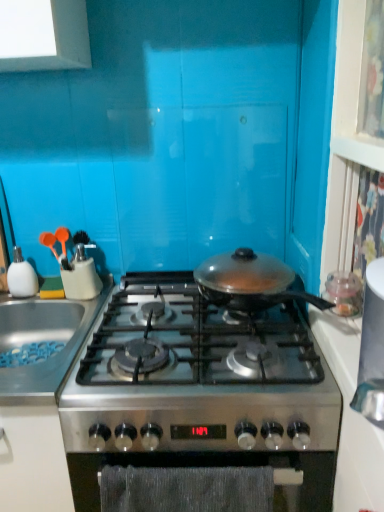
Question: Is textured gray oven at center behind white glossy soap dispenser at left?

Choices:
 (A) yes
 (B) no

Answer: (B)

Question: From the image's perspective, would you say textured gray oven at center is shown under white glossy soap dispenser at left?

Choices:
 (A) no
 (B) yes

Answer: (B)

Question: From a real-world perspective, is textured gray oven at center physically below white glossy soap dispenser at left?

Choices:
 (A) no
 (B) yes

Answer: (B)

Question: From the image's perspective, is textured gray oven at center over white glossy soap dispenser at left?

Choices:
 (A) no
 (B) yes

Answer: (A)

Question: Does textured gray oven at center appear on the right side of white glossy soap dispenser at left?

Choices:
 (A) yes
 (B) no

Answer: (A)

Question: Is the depth of textured gray oven at center less than that of white glossy soap dispenser at left?

Choices:
 (A) no
 (B) yes

Answer: (B)

Question: Does white glossy countertop at right have a lesser height compared to stainless steel gas stove at center?

Choices:
 (A) yes
 (B) no

Answer: (A)

Question: Can we say white glossy countertop at right lies outside stainless steel gas stove at center?

Choices:
 (A) no
 (B) yes

Answer: (B)

Question: Does white glossy countertop at right appear on the right side of stainless steel gas stove at center?

Choices:
 (A) yes
 (B) no

Answer: (A)

Question: From the image's perspective, does white glossy countertop at right appear higher than stainless steel gas stove at center?

Choices:
 (A) yes
 (B) no

Answer: (A)

Question: Is white glossy countertop at right facing towards stainless steel gas stove at center?

Choices:
 (A) yes
 (B) no

Answer: (A)

Question: Is white glossy countertop at right bigger than stainless steel gas stove at center?

Choices:
 (A) yes
 (B) no

Answer: (B)

Question: From the image's perspective, does white glossy countertop at right appear higher than white glossy soap dispenser at left?

Choices:
 (A) yes
 (B) no

Answer: (B)